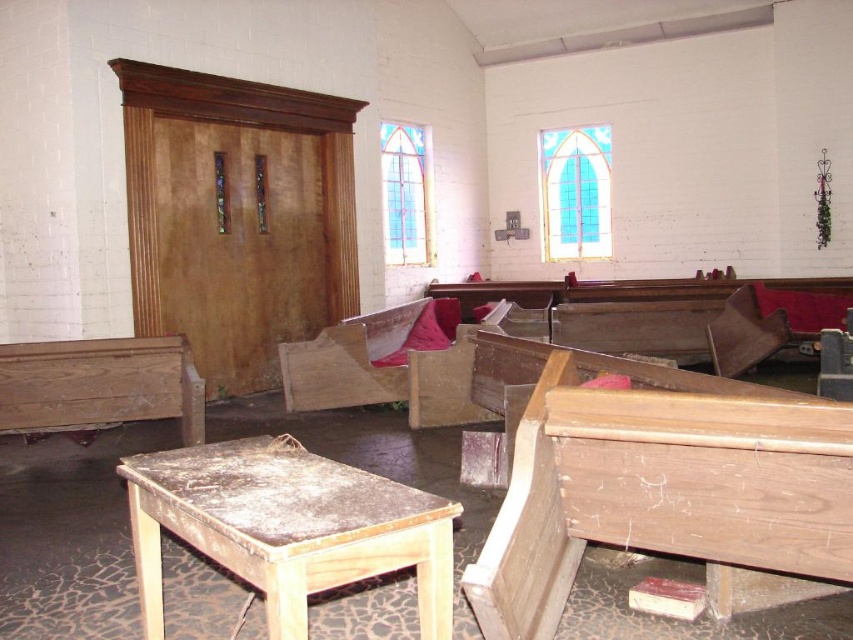
Question: In this image, where is wooden table at lower left located relative to wooden bench at left?

Choices:
 (A) left
 (B) right

Answer: (B)

Question: Among these objects, which one is farthest from the camera?

Choices:
 (A) wooden table at lower left
 (B) wooden chair at right

Answer: (B)

Question: Does wooden bench at left appear under wooden chair at right?

Choices:
 (A) no
 (B) yes

Answer: (B)

Question: Can you confirm if wooden table at lower left is positioned to the right of wooden bench at left?

Choices:
 (A) no
 (B) yes

Answer: (B)

Question: Which of the following is the farthest from the observer?

Choices:
 (A) (724, 316)
 (B) (154, 572)
 (C) (80, 420)

Answer: (A)

Question: Which object is farther from the camera taking this photo?

Choices:
 (A) wooden chair at right
 (B) wooden table at lower left
 (C) wooden bench at left

Answer: (A)